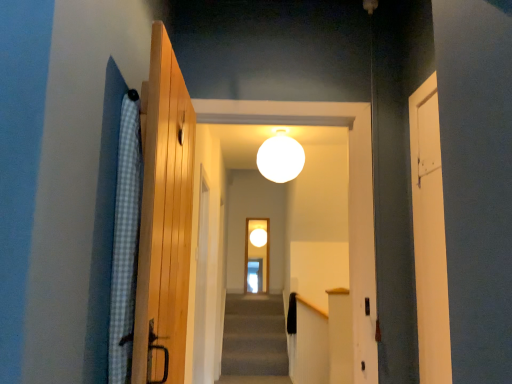
Question: Based on their sizes in the image, would you say wooden door at center, which is the first door in left-to-right order, is bigger or smaller than white matte sphere at center?

Choices:
 (A) big
 (B) small

Answer: (A)

Question: Considering the positions of wooden door at center, the third door when ordered from right to left, and white matte sphere at center in the image, is wooden door at center, the third door when ordered from right to left, wider or thinner than white matte sphere at center?

Choices:
 (A) wide
 (B) thin

Answer: (B)

Question: Estimate the real-world distances between objects in this image. Which object is closer to the wooden door at left, the third door when ordered from back to front?

Choices:
 (A) white matte sphere at center
 (B) translucent glass screen door at center
 (C) wooden door at center, the third door when ordered from right to left
 (D) white matte door at right, marked as the first door in a right-to-left arrangement
 (E) blue checkered fabric at left

Answer: (E)

Question: Based on their relative distances, which object is nearer to the wooden door at center, which is the first door in left-to-right order?

Choices:
 (A) white matte door at right, the 3th door in the left-to-right sequence
 (B) wooden door at left, the second door positioned from the right
 (C) translucent glass screen door at center
 (D) white matte sphere at center
 (E) blue checkered fabric at left

Answer: (D)